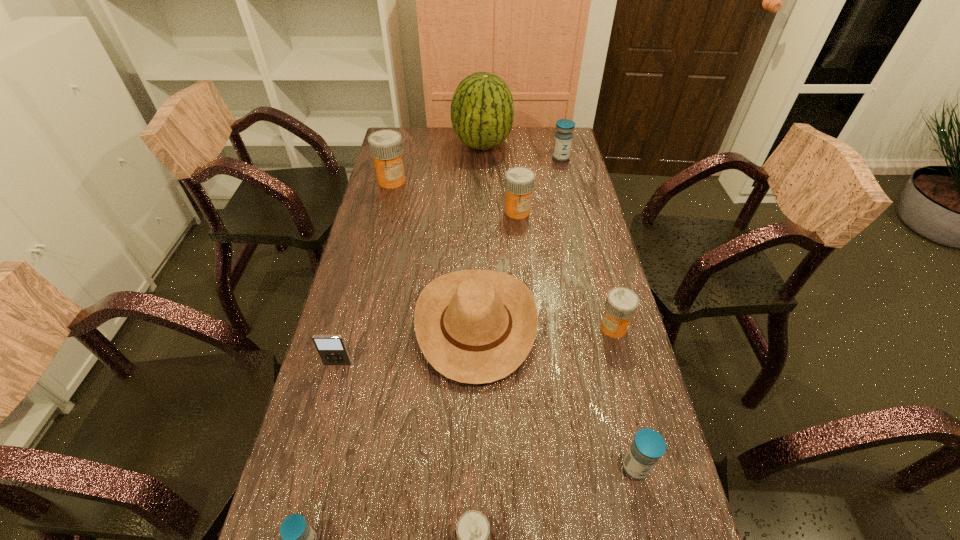
This screenshot has height=540, width=960. Identify the location of the second smallest orange medicine. (621, 304).

Locate an element on the screen. The width and height of the screenshot is (960, 540). the third nearest medicine is located at coordinates (648, 446).

I want to click on the eighth farthest object, so click(x=648, y=446).

At what (x,y) coordinates should I click in order to perform the action: click on iPod. Please return your answer as a coordinate pair (x, y). The image size is (960, 540). Looking at the image, I should click on (332, 350).

You are a GUI agent. You are given a task and a screenshot of the screen. Output one action in this format:
    pyautogui.click(x=<x>, y=<y>)
    Task: Click on the vacant space located 0.110m on the left of the green watermelon
    
    Given the screenshot: What is the action you would take?
    pyautogui.click(x=426, y=145)

This screenshot has width=960, height=540. Find the location of `vacant space positioned 0.080m on the label side of the third farthest object`. vacant space positioned 0.080m on the label side of the third farthest object is located at coordinates (387, 202).

The height and width of the screenshot is (540, 960). Find the location of `vacant space positioned on the front of the farthest medicine`. vacant space positioned on the front of the farthest medicine is located at coordinates click(564, 172).

The image size is (960, 540). I want to click on vacant space situated on the label side of the second farthest orange medicine, so [525, 293].

Where is `vacant space located 0.240m on the front-facing side of the brown cowboy hat`? vacant space located 0.240m on the front-facing side of the brown cowboy hat is located at coordinates (624, 325).

The height and width of the screenshot is (540, 960). What are the coordinates of `free space located on the label side of the fourth nearest medicine` in the screenshot? It's located at (481, 328).